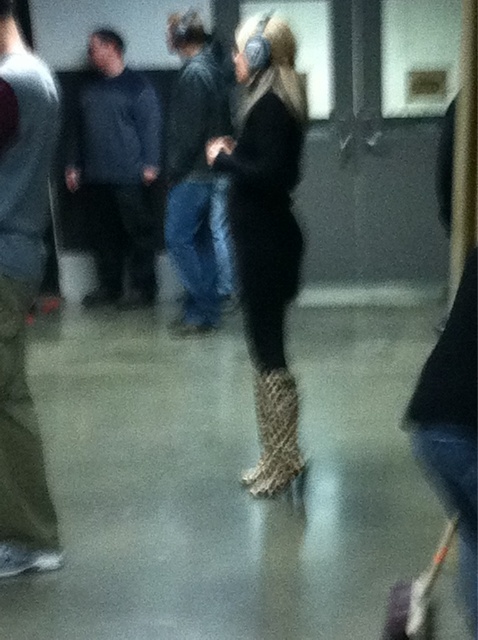
Is leopard print boots at center shorter than dark blue jacket at left?

Indeed, leopard print boots at center has a lesser height compared to dark blue jacket at left.

From the picture: Who is taller, leopard print boots at center or dark blue jacket at left?

With more height is dark blue jacket at left.

This screenshot has height=640, width=478. Describe the element at coordinates (267, 230) in the screenshot. I see `leopard print boots at center` at that location.

The image size is (478, 640). In order to click on leopard print boots at center in this screenshot , I will do `click(267, 230)`.

Does dark blue jacket at left lie behind leather jacket at center?

Yes.

Is dark blue jacket at left in front of leather jacket at center?

No, it is not.

Between point (152, 177) and point (175, 256), which one is positioned in front?

Point (175, 256) is in front.

This screenshot has width=478, height=640. I want to click on dark blue jacket at left, so click(x=117, y=170).

Is dark blue jeans at left above leopard print boot at center?

Yes, dark blue jeans at left is above leopard print boot at center.

Is point (45, 108) behind point (291, 376)?

No.

Who is more forward, [10,342] or [268,483]?

Point [10,342] is in front.

Find the location of `dark blue jeans at left`. dark blue jeans at left is located at coordinates (22, 296).